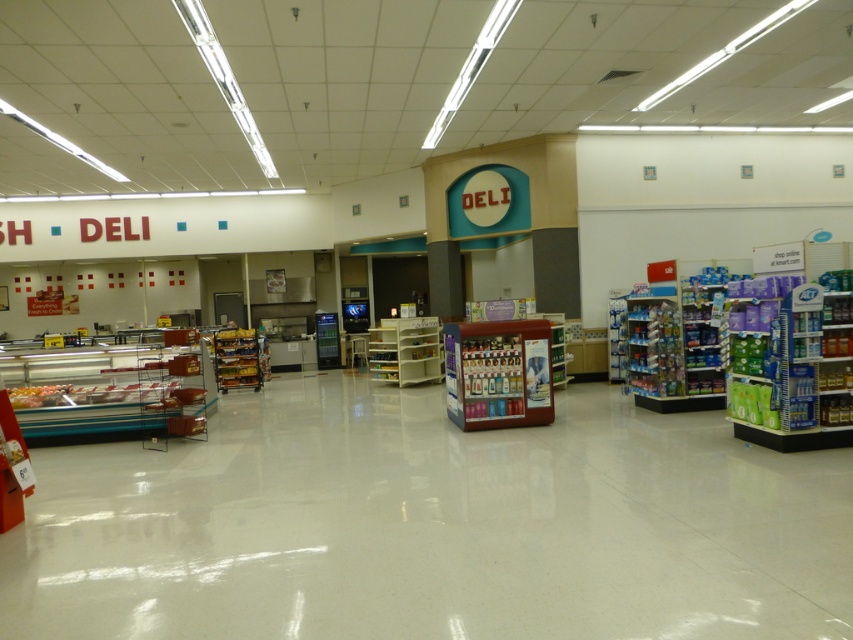
Question: Does clear plastic shelf at left appear over metallic silver shelves at center?

Choices:
 (A) yes
 (B) no

Answer: (B)

Question: Considering the real-world distances, which object is closest to the metallic red beverage cooler at center?

Choices:
 (A) white glossy floor at center
 (B) clear plastic shelf at left
 (C) metallic silver shelves at center

Answer: (A)

Question: Is clear plastic shelf at left bigger than metallic red beverage cooler at center?

Choices:
 (A) no
 (B) yes

Answer: (B)

Question: Which of the following is the closest to the observer?

Choices:
 (A) metallic silver shelves at center
 (B) white glossy floor at center
 (C) clear plastic shelf at left

Answer: (B)

Question: From the image, what is the correct spatial relationship of white glossy floor at center in relation to blue plastic shelf at right?

Choices:
 (A) above
 (B) below

Answer: (B)

Question: Estimate the real-world distances between objects in this image. Which object is farther from the wooden shelf at center?

Choices:
 (A) white glossy floor at center
 (B) clear plastic shelf at left

Answer: (A)